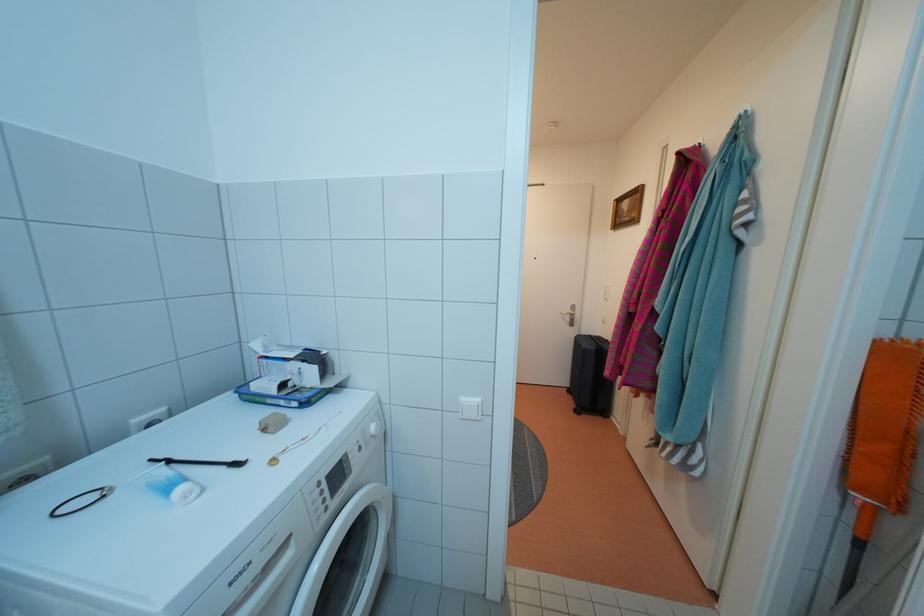
The width and height of the screenshot is (924, 616). Find the location of `washing machine dial`. washing machine dial is located at coordinates (337, 475).